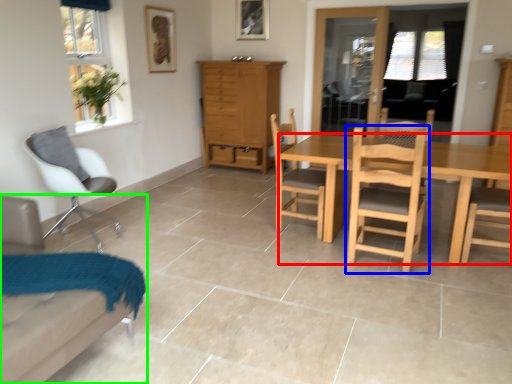
Question: Considering the real-world distances, which object is farthest from desk (highlighted by a red box)? chair (highlighted by a blue box) or chair (highlighted by a green box)?

Choices:
 (A) chair
 (B) chair

Answer: (B)